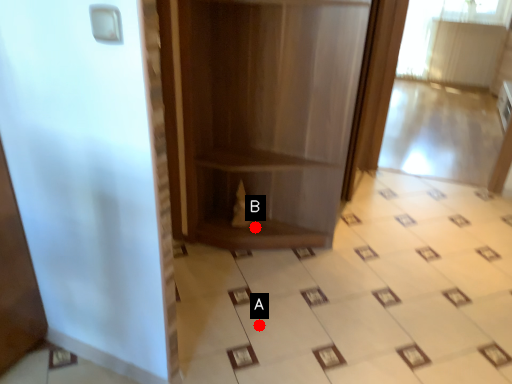
Question: Two points are circled on the image, labeled by A and B beside each circle. Which point appears closest to the camera in this image?

Choices:
 (A) A is closer
 (B) B is closer

Answer: (A)